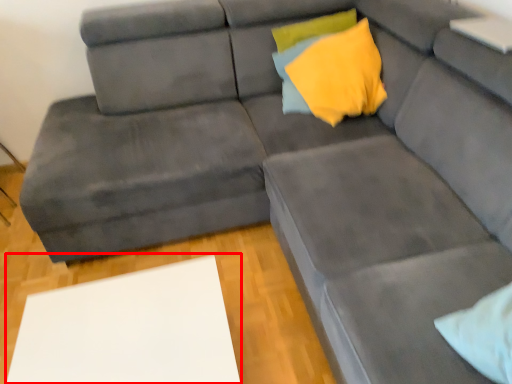
Question: Considering the relative positions of table (annotated by the red box) and pillow in the image provided, where is table (annotated by the red box) located with respect to the staircase?

Choices:
 (A) right
 (B) left

Answer: (B)